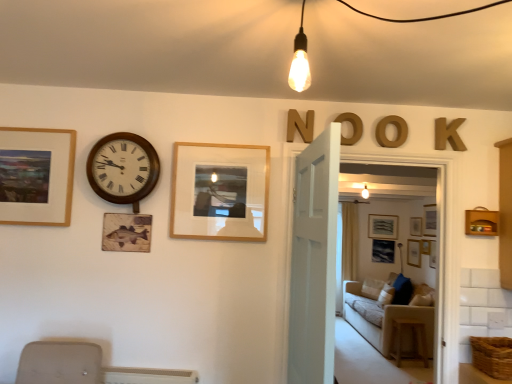
Identify the location of free space above transparent glass door at center (from a real-world perspective). This screenshot has width=512, height=384. [x=390, y=145].